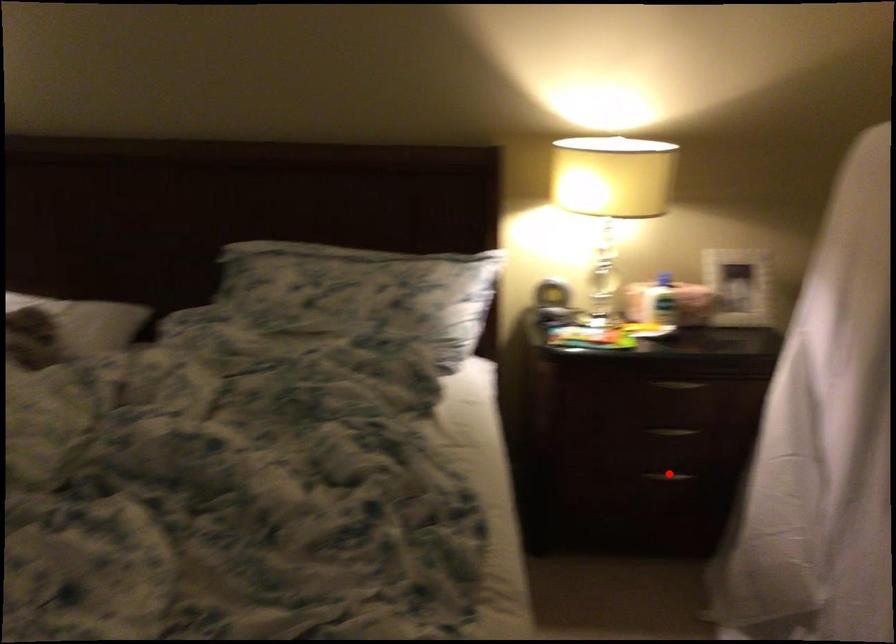
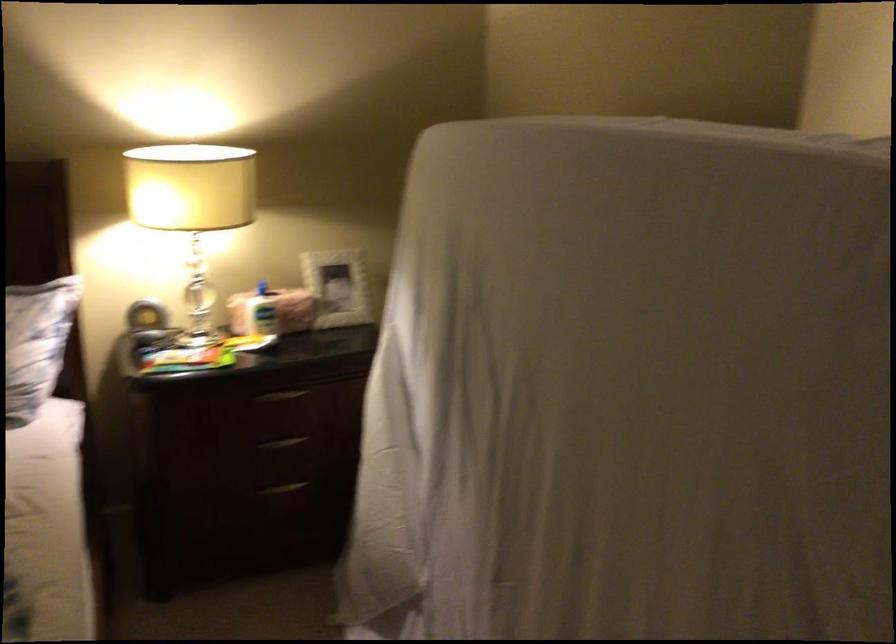
Find the pixel in the second image that matches the highlighted location in the first image.

(283, 488)